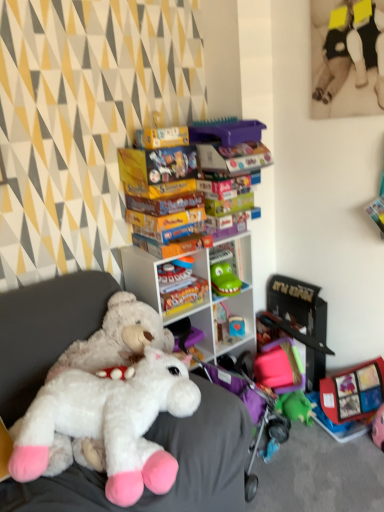
Question: Is white plastic shelf at center positioned far away from black plastic toy at right, positioned as the third toy in top-to-bottom order?

Choices:
 (A) yes
 (B) no

Answer: (B)

Question: Can you confirm if white plastic shelf at center is bigger than black plastic toy at right, positioned as the third toy in top-to-bottom order?

Choices:
 (A) no
 (B) yes

Answer: (B)

Question: Can you confirm if white plastic shelf at center is positioned to the right of black plastic toy at right, which is counted as the second toy, starting from the back?

Choices:
 (A) no
 (B) yes

Answer: (A)

Question: Does white plastic shelf at center contain black plastic toy at right, positioned as the third toy in top-to-bottom order?

Choices:
 (A) yes
 (B) no

Answer: (B)

Question: Is white plastic shelf at center completely or partially outside of black plastic toy at right, which is counted as the second toy, starting from the back?

Choices:
 (A) yes
 (B) no

Answer: (A)

Question: Is the depth of white plastic shelf at center greater than that of black plastic toy at right, the 1th toy in the bottom-to-top sequence?

Choices:
 (A) no
 (B) yes

Answer: (A)

Question: Is white plush toy at center facing away from soft plush toy at upper right, which is counted as the 3th toy, starting from the bottom?

Choices:
 (A) no
 (B) yes

Answer: (A)

Question: Does white plush toy at center have a smaller size compared to soft plush toy at upper right, acting as the third toy starting from the back?

Choices:
 (A) yes
 (B) no

Answer: (B)

Question: Can you confirm if white plush toy at center is positioned to the right of soft plush toy at upper right, which is counted as the 3th toy, starting from the bottom?

Choices:
 (A) yes
 (B) no

Answer: (B)

Question: Is white plush toy at center far away from soft plush toy at upper right, positioned as the first toy in front-to-back order?

Choices:
 (A) yes
 (B) no

Answer: (A)

Question: Can you confirm if white plush toy at center is bigger than soft plush toy at upper right, acting as the third toy starting from the back?

Choices:
 (A) yes
 (B) no

Answer: (A)

Question: Is soft plush toy at upper right, acting as the third toy starting from the back, completely or partially inside white plush toy at center?

Choices:
 (A) no
 (B) yes

Answer: (A)

Question: Is white plush toy at center a part of smooth plastic toy at center, which is counted as the second toy, starting from the bottom?

Choices:
 (A) yes
 (B) no

Answer: (B)